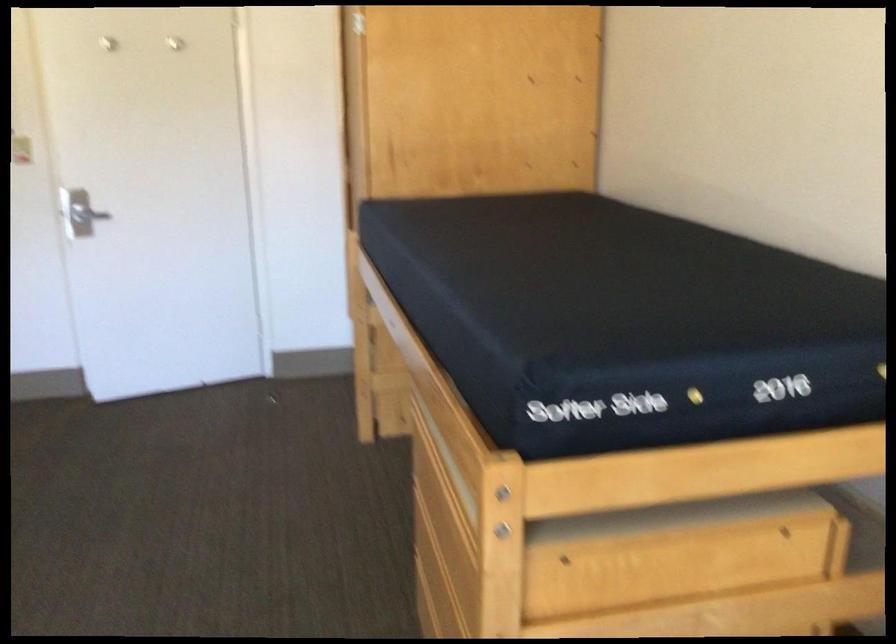
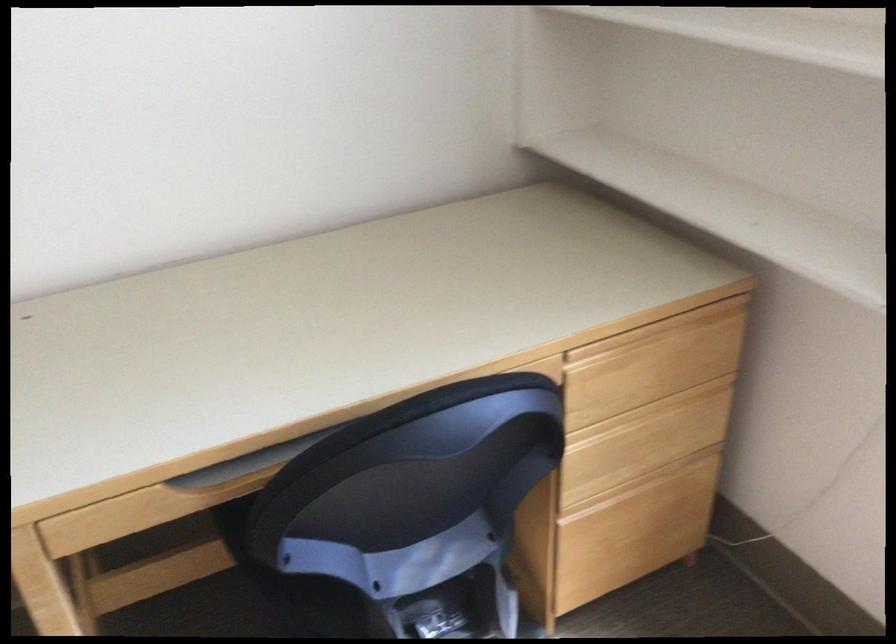
Based on the continuous images, in which direction is the camera rotating?

The camera rotated toward right-down.